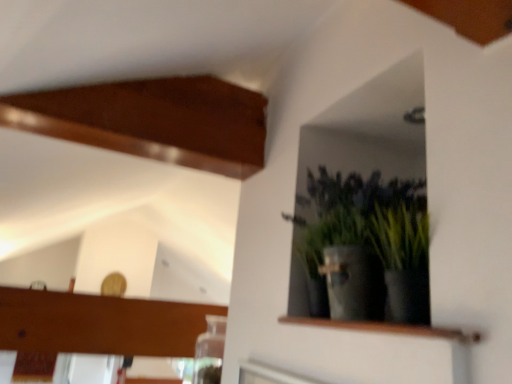
Question: In terms of width, does green matte plant at upper right look wider or thinner when compared to wooden shelf at upper right?

Choices:
 (A) thin
 (B) wide

Answer: (B)

Question: In terms of height, does green matte plant at upper right look taller or shorter compared to wooden shelf at upper right?

Choices:
 (A) tall
 (B) short

Answer: (A)

Question: In the image, is green matte plant at upper right positioned in front of or behind wooden shelf at upper right?

Choices:
 (A) front
 (B) behind

Answer: (B)

Question: Looking at their shapes, would you say wooden shelf at upper right is wider or thinner than green matte plant at upper right?

Choices:
 (A) thin
 (B) wide

Answer: (A)

Question: Visually, is wooden shelf at upper right positioned to the left or to the right of green matte plant at upper right?

Choices:
 (A) right
 (B) left

Answer: (B)

Question: Is wooden shelf at upper right situated inside green matte plant at upper right or outside?

Choices:
 (A) outside
 (B) inside

Answer: (A)

Question: From the image's perspective, is wooden shelf at upper right located above or below green matte plant at upper right?

Choices:
 (A) below
 (B) above

Answer: (A)